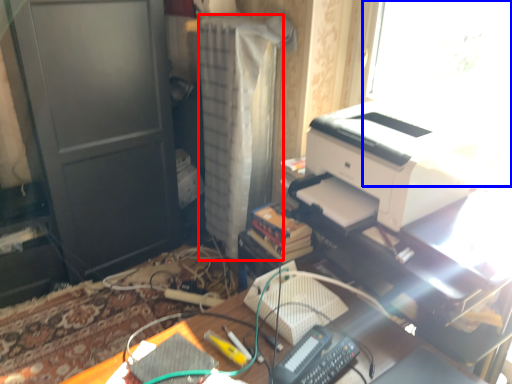
Question: Among these objects, which one is nearest to the camera, curtain (highlighted by a red box) or window screen (highlighted by a blue box)?

Choices:
 (A) curtain
 (B) window screen

Answer: (B)